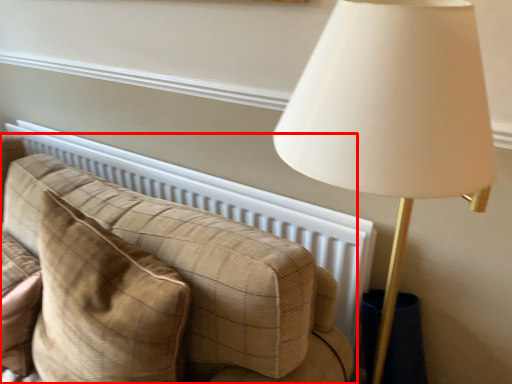
Question: From the image, what is the correct spatial relationship of studio couch (annotated by the red box) in relation to throw pillow?

Choices:
 (A) left
 (B) right

Answer: (A)